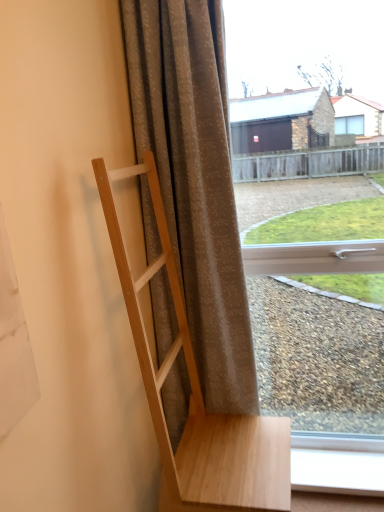
Question: From a real-world perspective, is matte gray curtain at center positioned over transparent glass window at center based on gravity?

Choices:
 (A) no
 (B) yes

Answer: (B)

Question: Is matte gray curtain at center aimed at transparent glass window at center?

Choices:
 (A) yes
 (B) no

Answer: (B)

Question: Is transparent glass window at center inside matte gray curtain at center?

Choices:
 (A) yes
 (B) no

Answer: (B)

Question: Is matte gray curtain at center outside of transparent glass window at center?

Choices:
 (A) no
 (B) yes

Answer: (B)

Question: From a real-world perspective, is matte gray curtain at center beneath transparent glass window at center?

Choices:
 (A) no
 (B) yes

Answer: (A)

Question: Considering the positions of natural wood coat rack at left and white plastic window frame at lower right in the image, is natural wood coat rack at left bigger or smaller than white plastic window frame at lower right?

Choices:
 (A) small
 (B) big

Answer: (B)

Question: From the image's perspective, relative to white plastic window frame at lower right, is natural wood coat rack at left above or below?

Choices:
 (A) below
 (B) above

Answer: (B)

Question: Is point (198, 470) closer or farther from the camera than point (301, 462)?

Choices:
 (A) farther
 (B) closer

Answer: (B)

Question: From their relative heights in the image, would you say natural wood coat rack at left is taller or shorter than white plastic window frame at lower right?

Choices:
 (A) tall
 (B) short

Answer: (A)

Question: From the image's perspective, is white plastic window frame at lower right above or below transparent glass window at center?

Choices:
 (A) below
 (B) above

Answer: (A)

Question: Visually, is white plastic window frame at lower right positioned to the left or to the right of transparent glass window at center?

Choices:
 (A) right
 (B) left

Answer: (A)

Question: In terms of width, does white plastic window frame at lower right look wider or thinner when compared to transparent glass window at center?

Choices:
 (A) wide
 (B) thin

Answer: (A)

Question: Do you think white plastic window frame at lower right is within transparent glass window at center, or outside of it?

Choices:
 (A) inside
 (B) outside

Answer: (B)

Question: From a real-world perspective, is matte gray curtain at center physically located above or below white plastic window frame at lower right?

Choices:
 (A) above
 (B) below

Answer: (A)

Question: Is matte gray curtain at center bigger or smaller than white plastic window frame at lower right?

Choices:
 (A) small
 (B) big

Answer: (B)